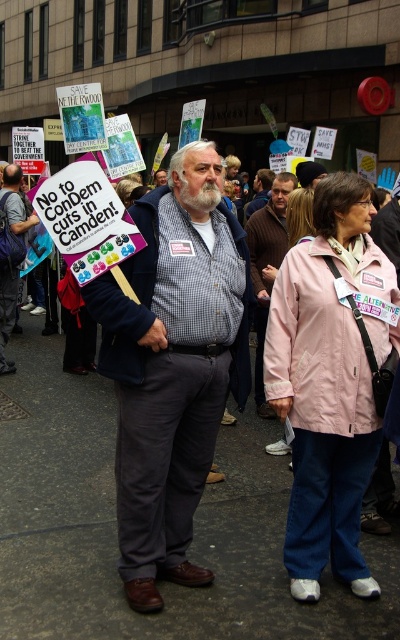
Question: Considering the real-world distances, which object is closest to the brown wool sweater at center?

Choices:
 (A) matte black jacket at center
 (B) checkered fabric shirt at center

Answer: (B)

Question: Which point is farther to the camera?

Choices:
 (A) pink fabric jacket at center
 (B) brown wool sweater at center
 (C) matte black jacket at center
 (D) checkered fabric shirt at center

Answer: (C)

Question: Is pink fabric jacket at center further to the viewer compared to brown wool sweater at center?

Choices:
 (A) yes
 (B) no

Answer: (B)

Question: Is pink fabric jacket at center above matte black jacket at center?

Choices:
 (A) yes
 (B) no

Answer: (B)

Question: Estimate the real-world distances between objects in this image. Which object is farther from the pink fabric jacket at center?

Choices:
 (A) checkered fabric shirt at center
 (B) brown wool sweater at center

Answer: (B)

Question: Can you confirm if checkered fabric shirt at center is thinner than matte black jacket at center?

Choices:
 (A) no
 (B) yes

Answer: (A)